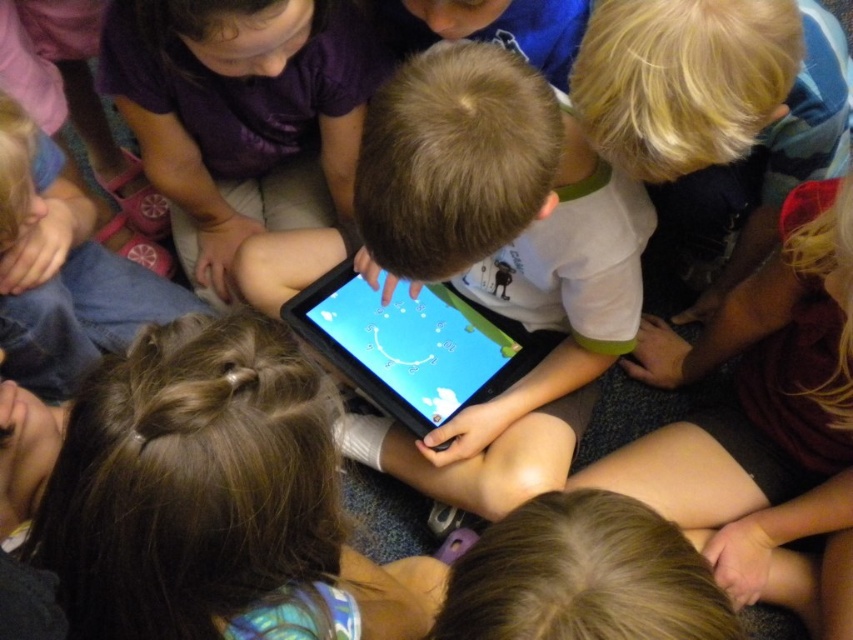
You are a teacher observing the children around the tablet. Which tablet is physically closer to the children, the smooth black tablet at center or the black plastic tablet at center?

The smooth black tablet at center is positioned over the black plastic tablet at center, so the smooth black tablet at center is closer to the children.

You are a teacher observing the children around the tablet. Which tablet is closer to the children, the smooth black tablet at center or the black plastic tablet at center?

The smooth black tablet at center is closer to the children because it is closer to the viewer than the black plastic tablet at center.

You are a teacher in a classroom where the children are gathered around two devices. You need to place a protective cover over both the smooth black tablet at center and the black plastic tablet at center. The cover you have is 5 inches wide. Will the cover fit over both devices if placed between them?

The smooth black tablet at center and the black plastic tablet at center are 4.90 inches apart from each other. Since the cover is 5 inches wide, it will fit over both devices as the distance between them is less than the cover width.